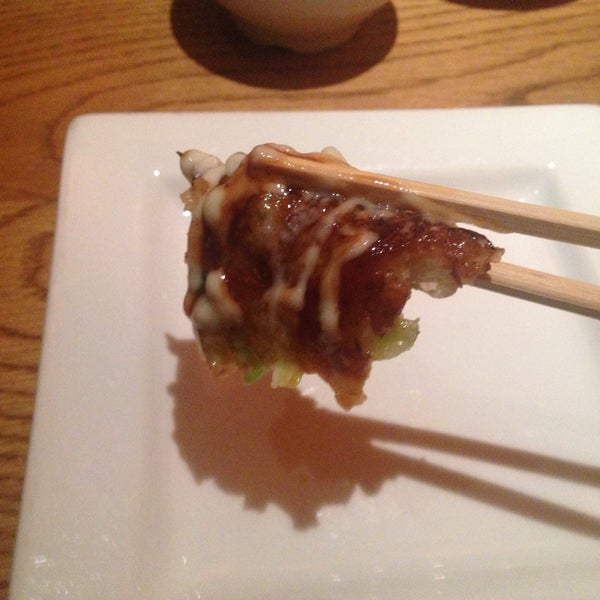
Identify the location of shadow on table. (x=366, y=53), (x=529, y=5).